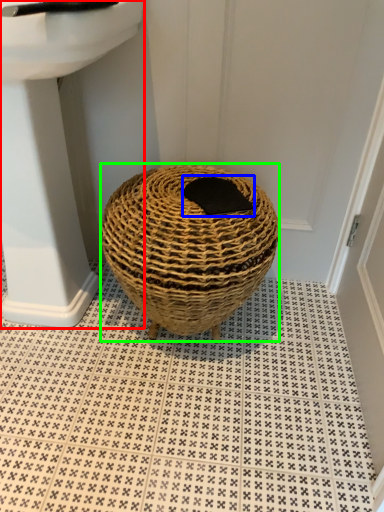
Question: Which is farther away from sink (highlighted by a red box)? pad (highlighted by a blue box) or basket (highlighted by a green box)?

Choices:
 (A) pad
 (B) basket

Answer: (A)